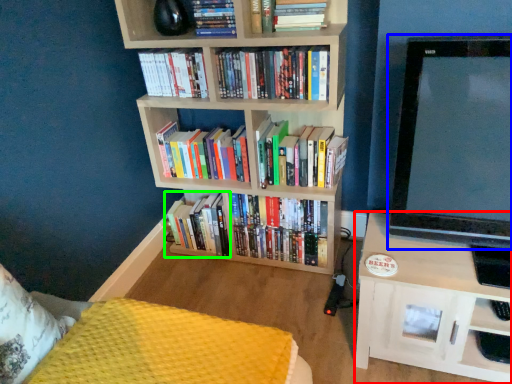
Question: Estimate the real-world distances between objects in this image. Which object is farther from shelf (highlighted by a red box), television (highlighted by a blue box) or book (highlighted by a green box)?

Choices:
 (A) television
 (B) book

Answer: (B)